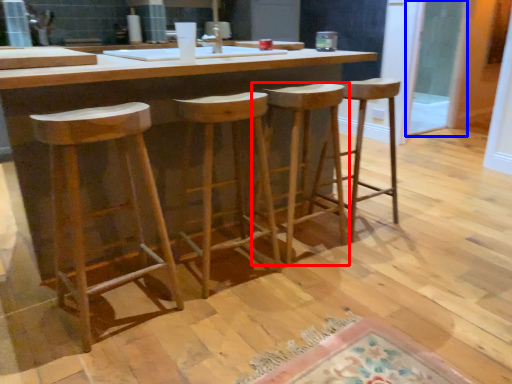
Question: Which object appears closest to the camera in this image, stool (highlighted by a red box) or glass door (highlighted by a blue box)?

Choices:
 (A) stool
 (B) glass door

Answer: (A)